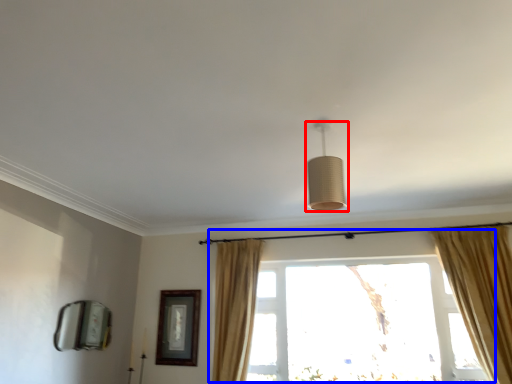
Question: Among these objects, which one is farthest to the camera, lamp (highlighted by a red box) or window (highlighted by a blue box)?

Choices:
 (A) lamp
 (B) window

Answer: (B)